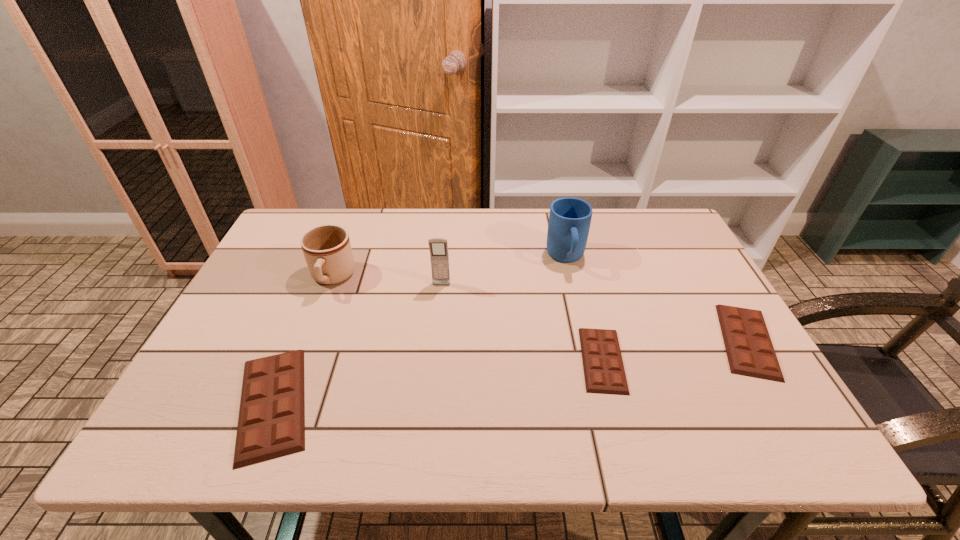
The height and width of the screenshot is (540, 960). Identify the location of the leftmost chocolate bar. (271, 424).

Identify the location of the shortest object. (604, 373).

Find the location of a particular element. This screenshot has width=960, height=540. the shortest chocolate bar is located at coordinates click(x=604, y=373).

The height and width of the screenshot is (540, 960). Find the location of `the rightmost object`. the rightmost object is located at coordinates (750, 352).

This screenshot has width=960, height=540. Identify the location of the rightmost chocolate bar. (750, 352).

I want to click on the fourth shortest object, so click(327, 249).

Identify the location of the shorter mug. The height and width of the screenshot is (540, 960). (327, 249).

Locate an element on the screen. Image resolution: width=960 pixels, height=540 pixels. the taller mug is located at coordinates (569, 222).

You are a GUI agent. You are given a task and a screenshot of the screen. Output one action in this format:
    pyautogui.click(x=<x>, y=<y>)
    Task: Click on the cellular telephone
    The image size is (960, 540).
    Given the screenshot: What is the action you would take?
    pyautogui.click(x=438, y=247)

Where is `vacant region located 0.380m on the right of the leftmost chocolate bar`? This screenshot has height=540, width=960. vacant region located 0.380m on the right of the leftmost chocolate bar is located at coordinates (498, 403).